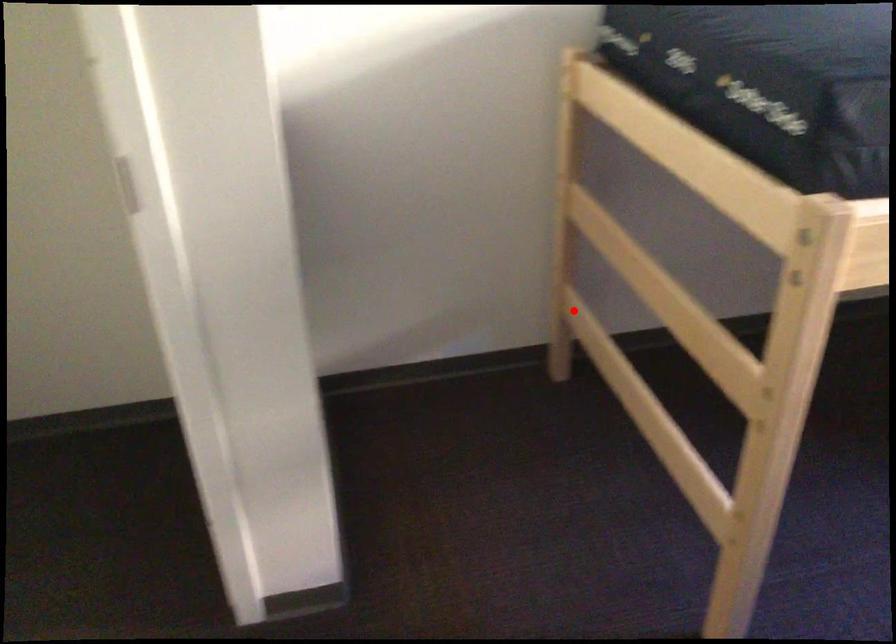
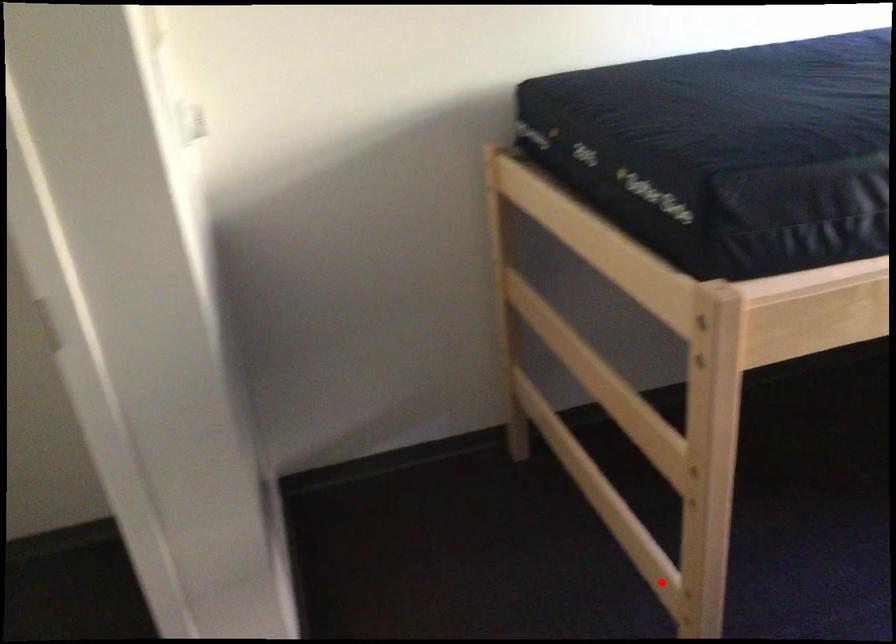
I am providing you with two images of the same scene from different viewpoints. A red point is marked on the first image and another point is marked on the second image. Are the points marked in image1 and image2 representing the same 3D position?

No